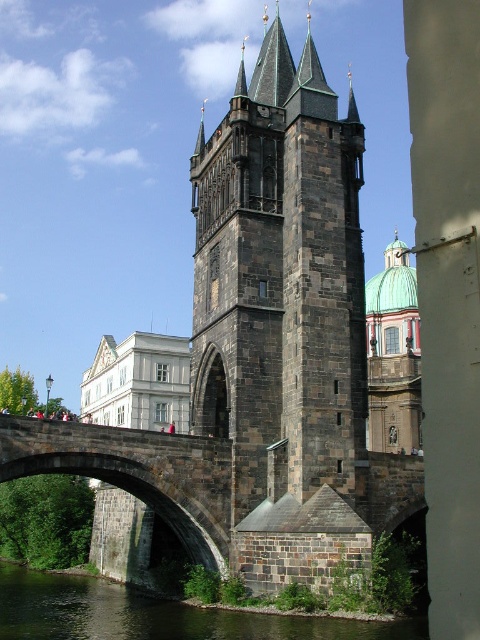
In order to click on dark stone tower at center in this screenshot , I will do `click(280, 278)`.

Consider the image. Does dark stone tower at center have a greater height compared to greenish stone water at lower left?

Indeed, dark stone tower at center has a greater height compared to greenish stone water at lower left.

This screenshot has height=640, width=480. What are the coordinates of `dark stone tower at center` in the screenshot? It's located at (280, 278).

The height and width of the screenshot is (640, 480). What are the coordinates of `dark stone tower at center` in the screenshot? It's located at (280, 278).